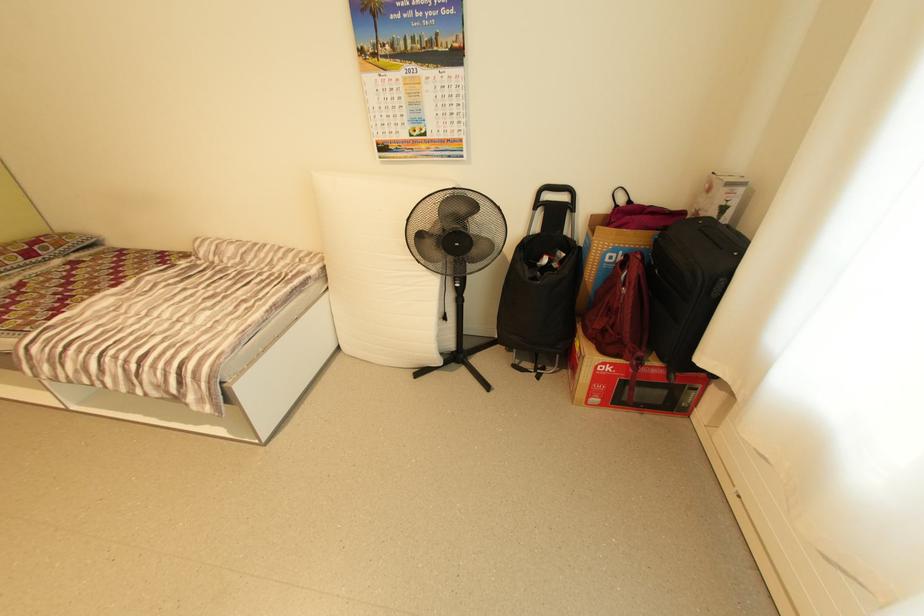
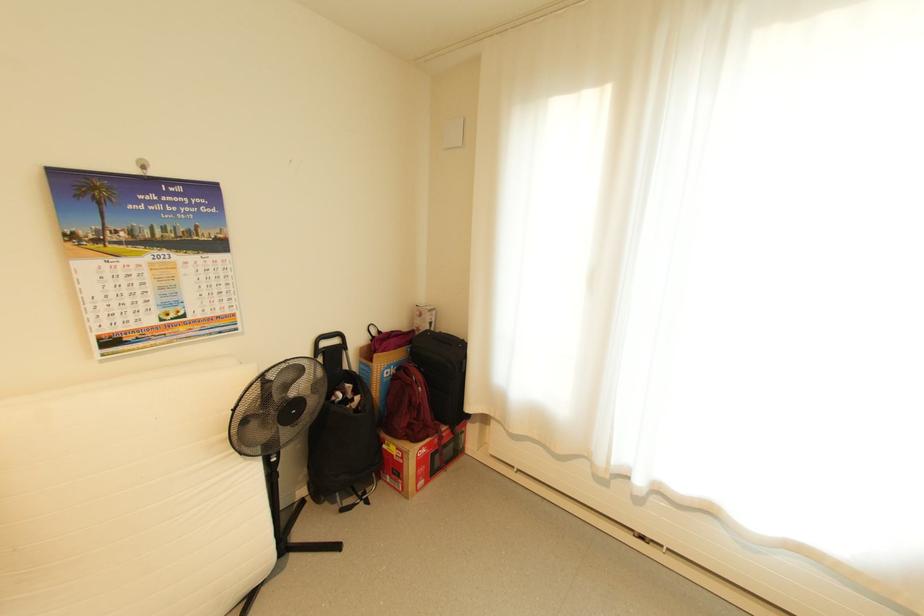
The point at (586, 347) is marked in the first image. Where is the corresponding point in the second image?

(404, 448)